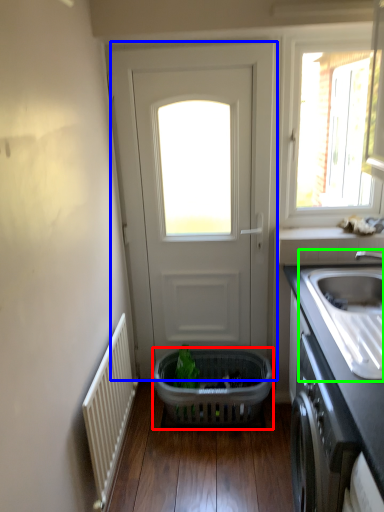
Question: Based on their relative distances, which object is nearer to basket (highlighted by a red box)? Choose from door (highlighted by a blue box) and sink (highlighted by a green box).

Choices:
 (A) door
 (B) sink

Answer: (A)